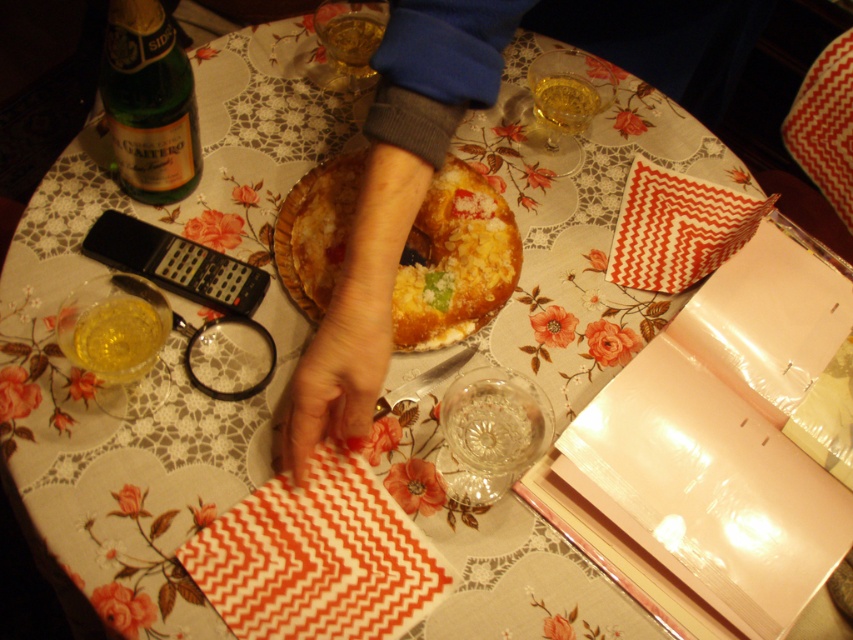
Question: Can you confirm if smooth skin hand at center is smaller than translucent glass at upper center?

Choices:
 (A) no
 (B) yes

Answer: (A)

Question: Estimate the real-world distances between objects in this image. Which object is closer to the smooth skin hand at center?

Choices:
 (A) dry skin at center
 (B) translucent glass at upper center
 (C) yellow cake at center

Answer: (A)

Question: Which of the following is the farthest from the observer?

Choices:
 (A) dry skin at center
 (B) translucent glass at upper center

Answer: (B)

Question: Is smooth skin hand at center to the left of translucent glass at upper center from the viewer's perspective?

Choices:
 (A) yes
 (B) no

Answer: (A)

Question: Can you confirm if smooth skin hand at center is positioned below yellow cake at center?

Choices:
 (A) yes
 (B) no

Answer: (B)

Question: Which object is positioned closest to the smooth skin hand at center?

Choices:
 (A) translucent glass at upper center
 (B) yellow cake at center
 (C) green glass bottle at upper left

Answer: (B)